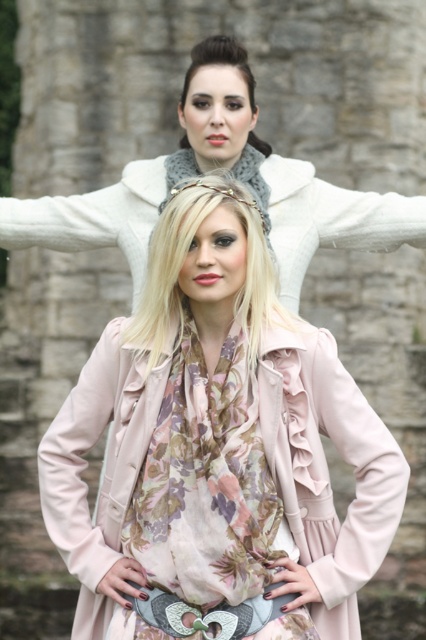
Question: Which of the following is the closest to the observer?

Choices:
 (A) matte pink coat at center
 (B) pink fabric coat at center
 (C) matte white scarf at upper center
 (D) matte pink coat at lower left

Answer: (B)

Question: Does matte pink coat at center appear on the right side of matte pink coat at lower left?

Choices:
 (A) yes
 (B) no

Answer: (A)

Question: Estimate the real-world distances between objects in this image. Which object is farther from the matte white scarf at upper center?

Choices:
 (A) matte pink coat at center
 (B) matte pink coat at lower left
 (C) pink fabric coat at center

Answer: (A)

Question: Is matte white scarf at upper center wider than matte pink coat at center?

Choices:
 (A) no
 (B) yes

Answer: (B)

Question: Is the position of matte pink coat at center less distant than that of matte pink coat at lower left?

Choices:
 (A) yes
 (B) no

Answer: (A)

Question: Which of the following is the closest to the observer?

Choices:
 (A) (48, 436)
 (B) (267, 401)
 (C) (264, 429)
 (D) (121, 195)

Answer: (C)